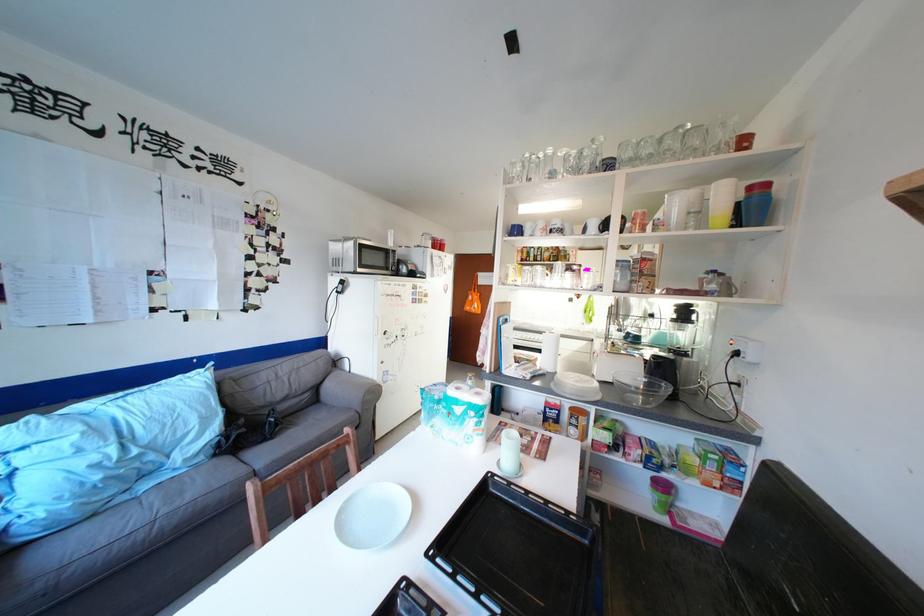
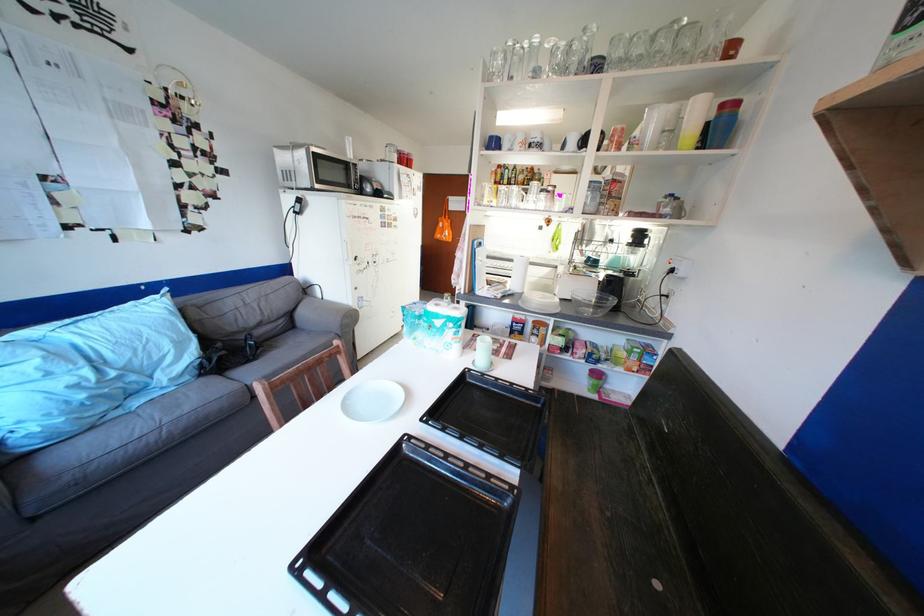
Locate, in the second image, the point that corresponds to [697,128] in the first image.

(694, 23)